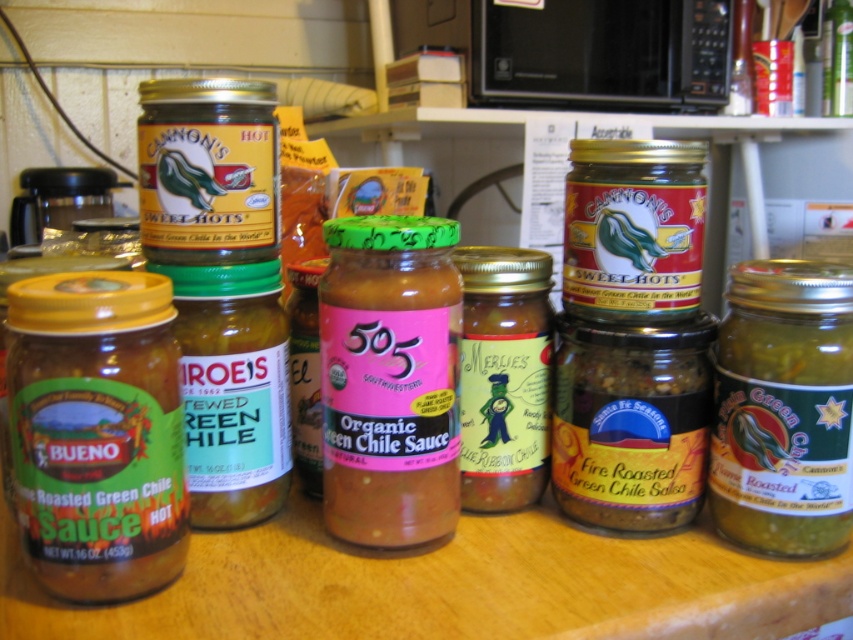
Question: Does green matte glass jar at left have a smaller size compared to green glass jar at center?

Choices:
 (A) no
 (B) yes

Answer: (A)

Question: Based on their relative distances, which object is nearer to the matte glass jar at center?

Choices:
 (A) green glass jar at right
 (B) green matte glass jar at center

Answer: (B)

Question: Can you confirm if green matte glass jar at left is positioned above matte glass jar at center?

Choices:
 (A) no
 (B) yes

Answer: (A)

Question: Which point appears farthest from the camera in this image?

Choices:
 (A) (720, 332)
 (B) (630, 419)

Answer: (A)

Question: Is green glass jar at center below matte glass jar at center?

Choices:
 (A) yes
 (B) no

Answer: (A)

Question: Estimate the real-world distances between objects in this image. Which object is farther from the matte glass jar at center?

Choices:
 (A) green matte glass jar at center
 (B) green glass jar at center
 (C) green glass jar at right
 (D) green matte glass jar at left

Answer: (D)